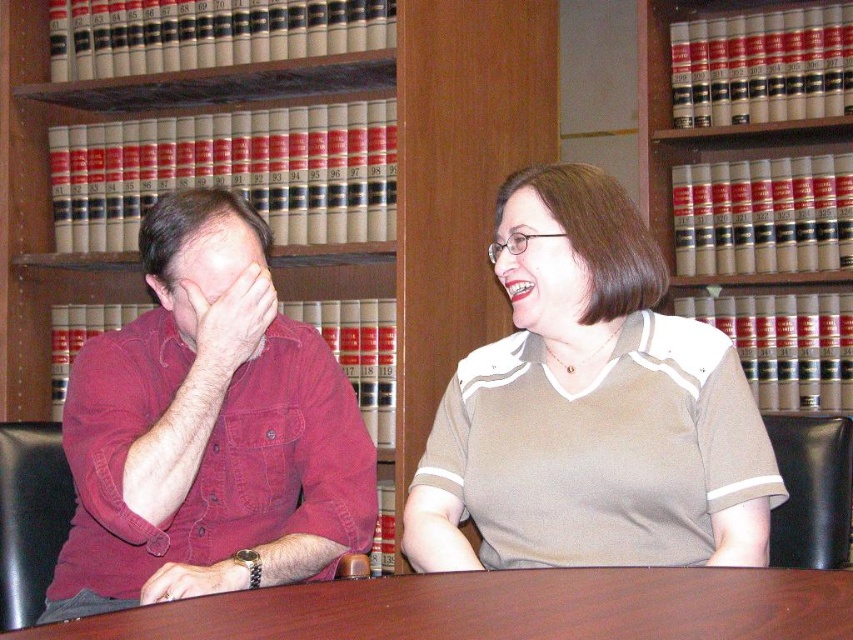
Does red shirt at left appear over beige paperbacks at upper right?

Incorrect, red shirt at left is not positioned above beige paperbacks at upper right.

Consider the image. Is red shirt at left taller than beige paperbacks at upper right?

Incorrect, red shirt at left's height is not larger of beige paperbacks at upper right's.

Locate an element on the screen. red shirt at left is located at coordinates (590, 406).

Which is behind, point (233, 397) or point (415, 129)?

The point (415, 129) is behind.

Based on the photo, is red shirt at left smaller than wooden bookshelf at center?

Yes.

Find the location of a particular element. The image size is (853, 640). red shirt at left is located at coordinates (590, 406).

Does wooden bookshelf at center have a greater width compared to brown wood table at center?

Yes.

Does wooden bookshelf at center have a smaller size compared to brown wood table at center?

No.

Is point (503, 304) in front of point (508, 612)?

No, (503, 304) is behind (508, 612).

Where is `wooden bookshelf at center`? This screenshot has height=640, width=853. wooden bookshelf at center is located at coordinates (322, 244).